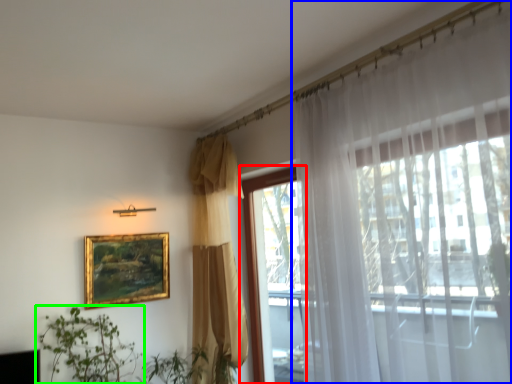
Question: Which object is positioned farthest from window (highlighted by a red box)? Select from curtain (highlighted by a blue box) and houseplant (highlighted by a green box).

Choices:
 (A) curtain
 (B) houseplant

Answer: (A)